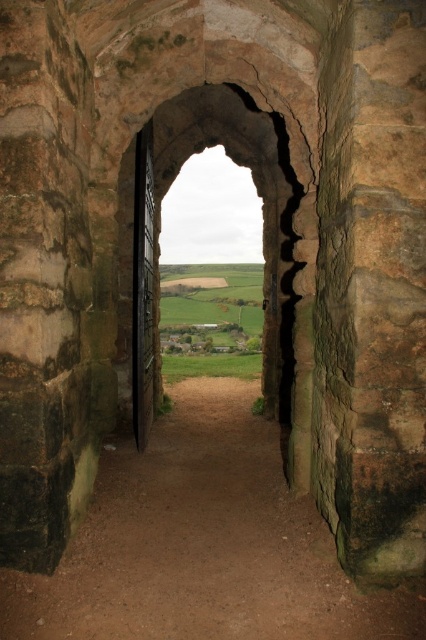
You are standing in front of the stone archway and want to step onto the path. Based on the scene, can you tell if the brown dirt path at center is in front of or behind the rough stone archway at center?

The brown dirt path at center is closer to the viewer than the rough stone archway at center, so it is in front of the archway.